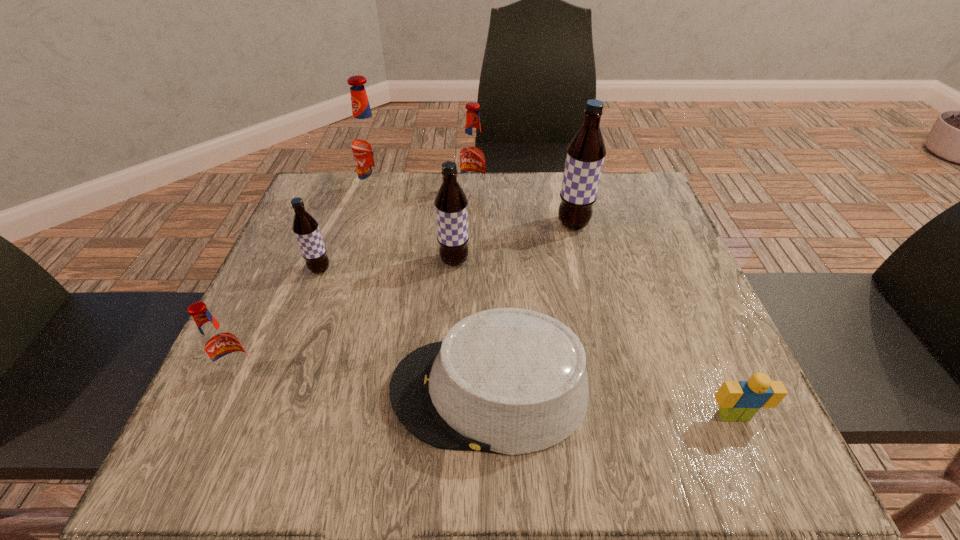
Locate an element on the screen. Image resolution: width=960 pixels, height=540 pixels. vacant space located on the front-facing side of the hat is located at coordinates (302, 391).

At what (x,y) coordinates should I click in order to perform the action: click on vacant region located 0.280m on the front-facing side of the hat. Please return your answer as a coordinate pair (x, y). Image resolution: width=960 pixels, height=540 pixels. Looking at the image, I should click on pyautogui.click(x=226, y=391).

This screenshot has height=540, width=960. Identify the location of vacant space located on the face of the beige Lego. (750, 454).

Locate an element on the screen. hat present at the near edge is located at coordinates tap(510, 381).

Where is `Lego at the near edge`? Image resolution: width=960 pixels, height=540 pixels. Lego at the near edge is located at coordinates (739, 401).

The height and width of the screenshot is (540, 960). What are the coordinates of `object present at the right edge` in the screenshot? It's located at (739, 401).

The image size is (960, 540). In order to click on object that is at the far left corner in this screenshot , I will do `click(368, 142)`.

At what (x,y) coordinates should I click in order to perform the action: click on object that is at the near right corner. Please return your answer as a coordinate pair (x, y). This screenshot has height=540, width=960. Looking at the image, I should click on (739, 401).

The width and height of the screenshot is (960, 540). What are the coordinates of `free point at the far edge` in the screenshot? It's located at (439, 190).

The height and width of the screenshot is (540, 960). I want to click on free space at the near edge, so click(x=505, y=467).